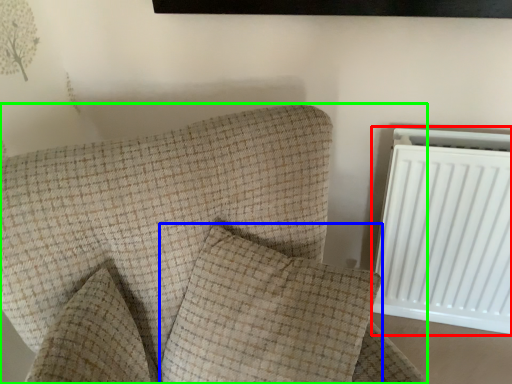
Question: Which is farther away from radiator (highlighted by a red box)? pillow (highlighted by a blue box) or furniture (highlighted by a green box)?

Choices:
 (A) pillow
 (B) furniture

Answer: (B)